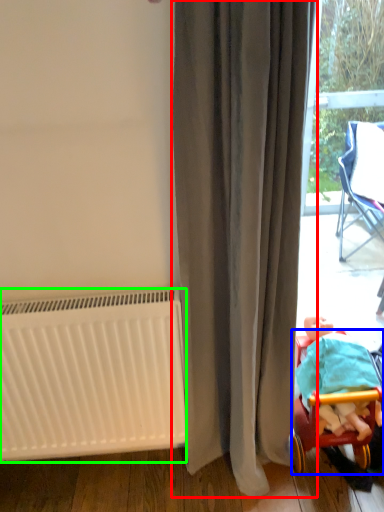
Question: Which object is positioned closest to curtain (highlighted by a red box)? Select from furniture (highlighted by a blue box) and radiator (highlighted by a green box).

Choices:
 (A) furniture
 (B) radiator

Answer: (B)